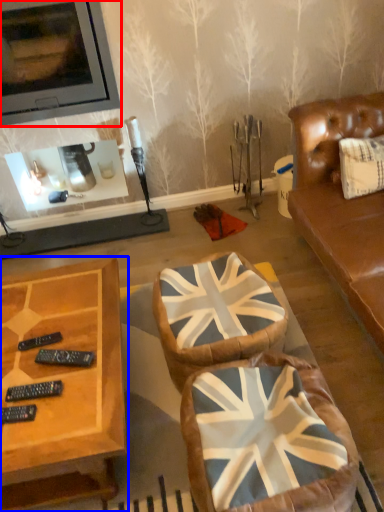
Question: Which point is closer to the camera, picture frame (highlighted by a red box) or coffee table (highlighted by a blue box)?

Choices:
 (A) picture frame
 (B) coffee table

Answer: (B)